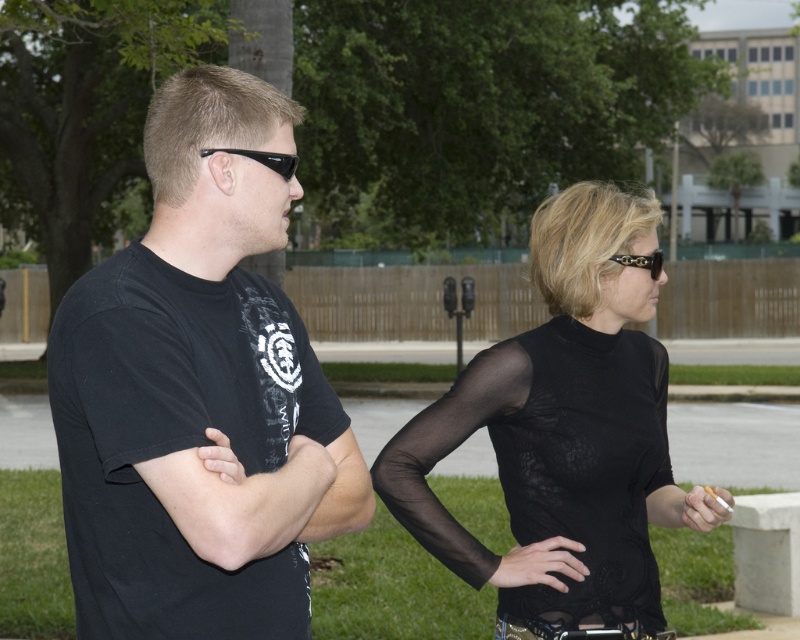
Can you confirm if black matte t-shirt at left is smaller than sheer black dress at center?

No.

Find the location of `black matte t-shirt at left`. black matte t-shirt at left is located at coordinates (194, 388).

Is point (304, 540) farther from camera compared to point (612, 577)?

No, (304, 540) is closer to viewer.

Locate an element on the screen. black matte t-shirt at left is located at coordinates (194, 388).

Does sheer black top at center have a larger size compared to sheer black dress at center?

Yes.

Consider the image. Is sheer black top at center to the left of sheer black dress at center from the viewer's perspective?

Indeed, sheer black top at center is positioned on the left side of sheer black dress at center.

This screenshot has width=800, height=640. Describe the element at coordinates (560, 426) in the screenshot. I see `sheer black top at center` at that location.

At what (x,y) coordinates should I click in order to perform the action: click on sheer black top at center. Please return your answer as a coordinate pair (x, y). This screenshot has height=640, width=800. Looking at the image, I should click on (560, 426).

Consider the image. Does black matte t-shirt at left appear under sheer black top at center?

No.

Can you confirm if black matte t-shirt at left is shorter than sheer black top at center?

Incorrect, black matte t-shirt at left's height does not fall short of sheer black top at center's.

Measure the distance between point (x=172, y=600) and camera.

Point (x=172, y=600) and camera are 3.23 meters apart from each other.

Identify the location of black matte t-shirt at left. The image size is (800, 640). (194, 388).